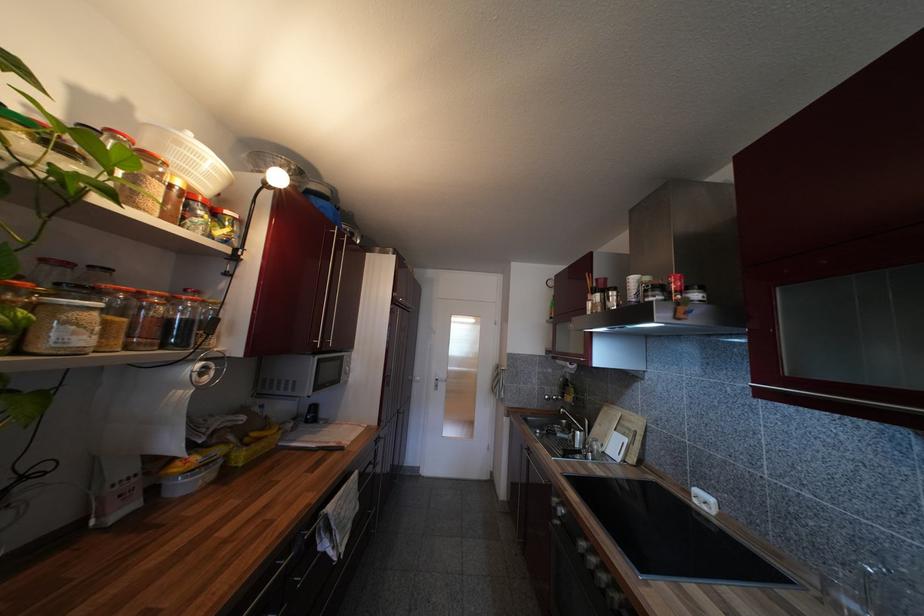
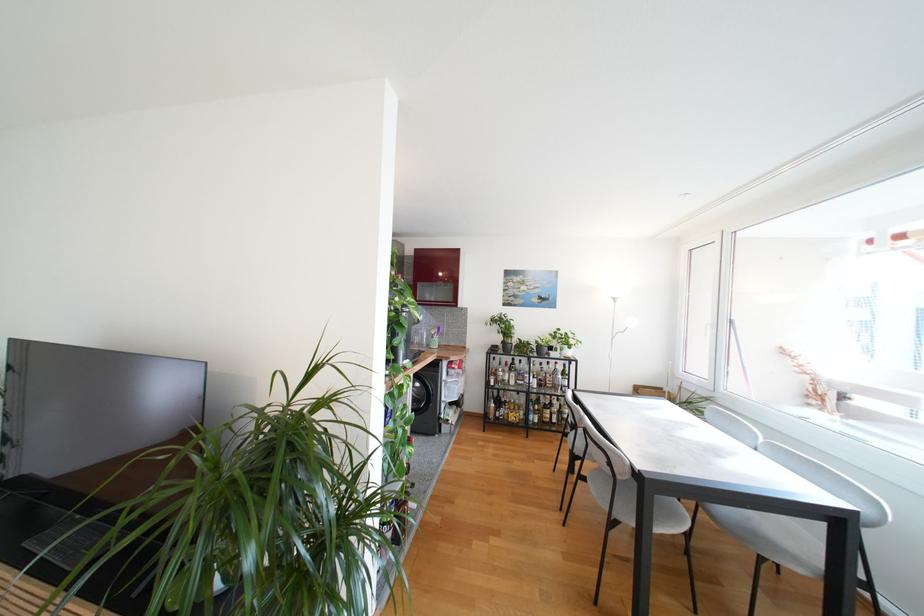
Question: I am providing you with two images of the same scene from different viewpoints. Which of the following objects are not visible in image2?

Choices:
 (A) white window handle
 (B) green file holder
 (C) utensil holder
 (D) silver cabinet handle

Answer: (D)